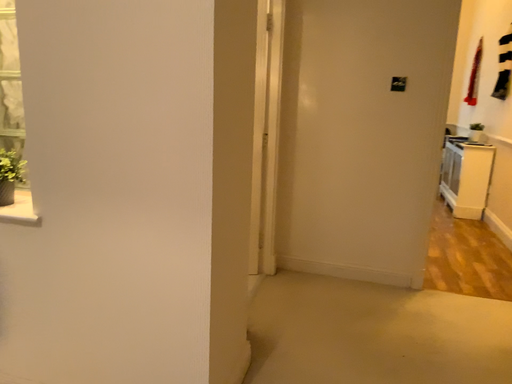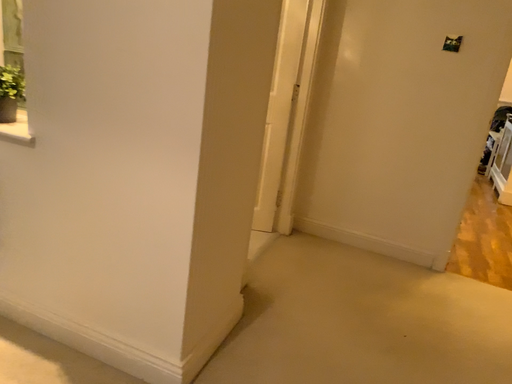
Question: Which way did the camera rotate in the video?

Choices:
 (A) rotated left
 (B) rotated right

Answer: (A)